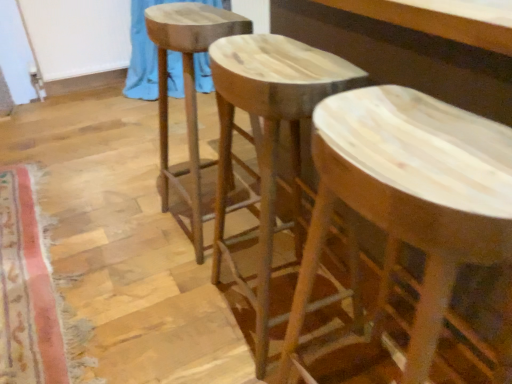
Question: From a real-world perspective, is natural wood stool at center, which is the 1th stool in left-to-right order, positioned over carpeted mat at lower left based on gravity?

Choices:
 (A) yes
 (B) no

Answer: (A)

Question: Considering the relative sizes of natural wood stool at center, which is the 1th stool in left-to-right order, and carpeted mat at lower left in the image provided, is natural wood stool at center, which is the 1th stool in left-to-right order, smaller than carpeted mat at lower left?

Choices:
 (A) yes
 (B) no

Answer: (B)

Question: Can you confirm if natural wood stool at center, which is the 1th stool in left-to-right order, is positioned to the left of carpeted mat at lower left?

Choices:
 (A) yes
 (B) no

Answer: (B)

Question: Would you consider natural wood stool at center, the third stool positioned from the right, to be distant from carpeted mat at lower left?

Choices:
 (A) yes
 (B) no

Answer: (B)

Question: Would you say carpeted mat at lower left is part of natural wood stool at center, the third stool positioned from the right,'s contents?

Choices:
 (A) yes
 (B) no

Answer: (B)

Question: From the image's perspective, is carpeted mat at lower left above or below natural wood stool at center, which is the 1th stool in left-to-right order?

Choices:
 (A) below
 (B) above

Answer: (A)

Question: Is carpeted mat at lower left wider or thinner than natural wood stool at center, which is the 1th stool in left-to-right order?

Choices:
 (A) thin
 (B) wide

Answer: (A)

Question: Is point (10, 357) positioned closer to the camera than point (195, 236)?

Choices:
 (A) closer
 (B) farther

Answer: (A)

Question: Is carpeted mat at lower left taller or shorter than natural wood stool at center, the third stool positioned from the right?

Choices:
 (A) short
 (B) tall

Answer: (A)

Question: Is natural wood stool at center, the third stool positioned from the right, taller or shorter than carpeted mat at lower left?

Choices:
 (A) short
 (B) tall

Answer: (B)

Question: Considering the positions of natural wood stool at center, which is the 1th stool in left-to-right order, and carpeted mat at lower left in the image, is natural wood stool at center, which is the 1th stool in left-to-right order, wider or thinner than carpeted mat at lower left?

Choices:
 (A) thin
 (B) wide

Answer: (B)

Question: From a real-world perspective, is natural wood stool at center, the third stool positioned from the right, positioned above or below carpeted mat at lower left?

Choices:
 (A) below
 (B) above

Answer: (B)

Question: Relative to carpeted mat at lower left, is natural wood stool at center, the third stool positioned from the right, in front or behind?

Choices:
 (A) front
 (B) behind

Answer: (B)

Question: Is blue fabric at upper left to the left or to the right of natural wood stool at center, the 2th stool positioned from the right, in the image?

Choices:
 (A) right
 (B) left

Answer: (B)

Question: Is blue fabric at upper left in front of or behind natural wood stool at center, marked as the second stool in a left-to-right arrangement, in the image?

Choices:
 (A) behind
 (B) front

Answer: (A)